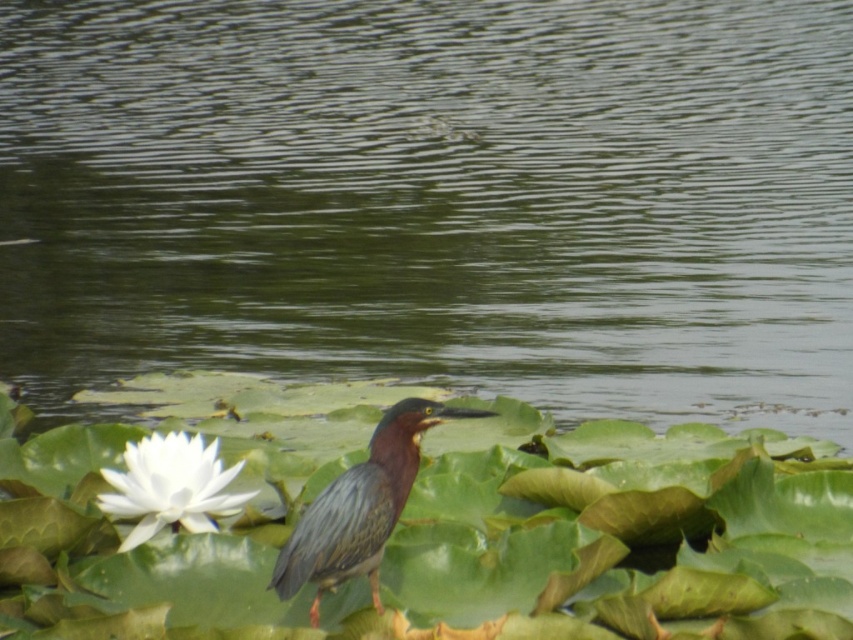
Who is lower down, greenish water at center or green glossy heron at center?

green glossy heron at center is below.

Can you confirm if greenish water at center is wider than green glossy heron at center?

Correct, the width of greenish water at center exceeds that of green glossy heron at center.

This screenshot has width=853, height=640. What are the coordinates of `greenish water at center` in the screenshot? It's located at (436, 200).

Where is `greenish water at center`? Image resolution: width=853 pixels, height=640 pixels. greenish water at center is located at coordinates (436, 200).

Is green glossy heron at center to the left of white matte flower at lower left from the viewer's perspective?

In fact, green glossy heron at center is to the right of white matte flower at lower left.

Find the location of a particular element. Image resolution: width=853 pixels, height=640 pixels. green glossy heron at center is located at coordinates (360, 506).

Where is `green glossy heron at center`? green glossy heron at center is located at coordinates (360, 506).

Who is more distant from viewer, (194, 109) or (97, 493)?

Positioned behind is point (194, 109).

Consider the image. Which is more to the left, greenish water at center or white matte flower at lower left?

From the viewer's perspective, greenish water at center appears more on the left side.

Describe the element at coordinates (436, 200) in the screenshot. I see `greenish water at center` at that location.

This screenshot has width=853, height=640. In order to click on greenish water at center in this screenshot , I will do `click(436, 200)`.